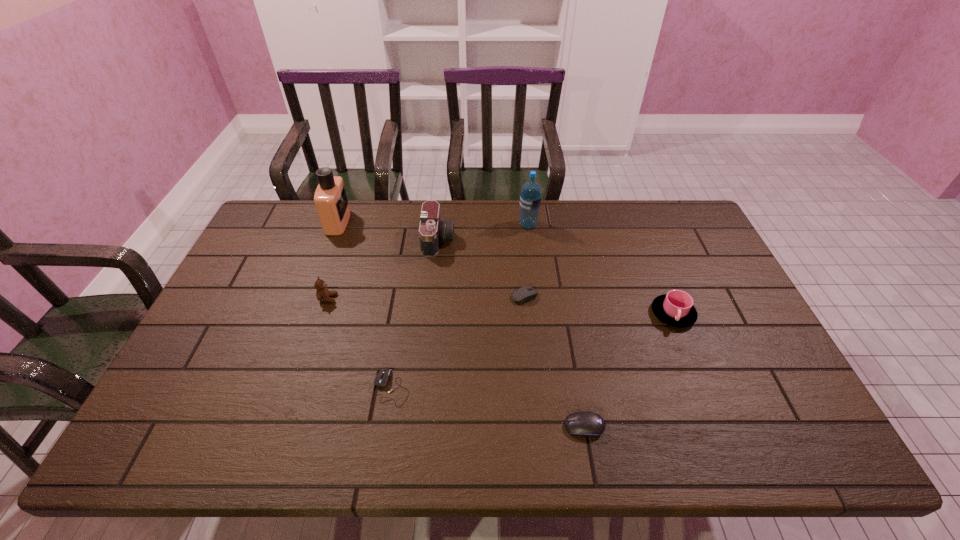
The width and height of the screenshot is (960, 540). What are the coordinates of `water bottle` in the screenshot? It's located at (530, 197).

Identify the location of perfume. The image size is (960, 540). (331, 201).

Identify the location of camera. (432, 230).

Identify the location of teddy bear. (322, 293).

Where is `the fourth shortest object`? The width and height of the screenshot is (960, 540). the fourth shortest object is located at coordinates (675, 308).

In order to click on cup in this screenshot , I will do `click(675, 308)`.

Locate an element on the screen. The image size is (960, 540). the nearest computer mouse is located at coordinates (586, 423).

Locate an element on the screen. This screenshot has height=540, width=960. the rightmost computer mouse is located at coordinates (586, 423).

You are a GUI agent. You are given a task and a screenshot of the screen. Output one action in this format:
    pyautogui.click(x=<x>, y=<y>)
    Task: Click on the second computer mouse from left to right
    
    Given the screenshot: What is the action you would take?
    pyautogui.click(x=526, y=293)

Image resolution: width=960 pixels, height=540 pixels. In order to click on the shortest computer mouse in this screenshot , I will do `click(382, 378)`.